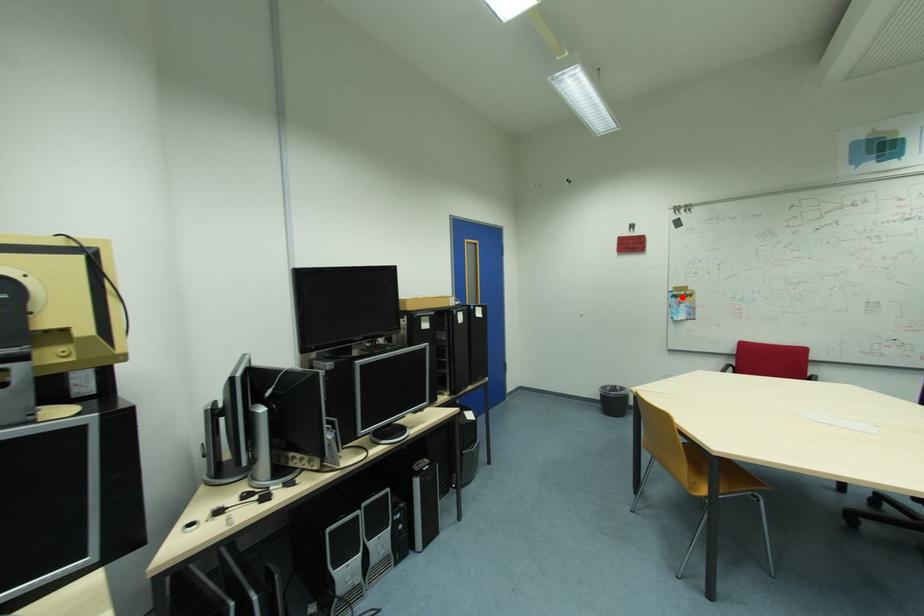
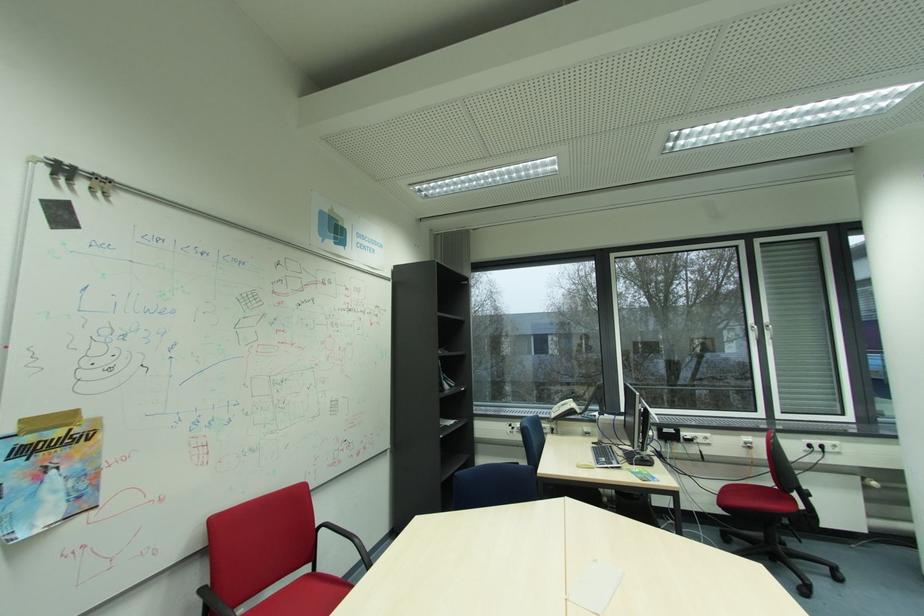
Question: I am providing you with two images of the same scene from different viewpoints. A red point is marked on the first image. Is the red point's position out of view in image 2?

Choices:
 (A) Yes
 (B) No

Answer: (B)